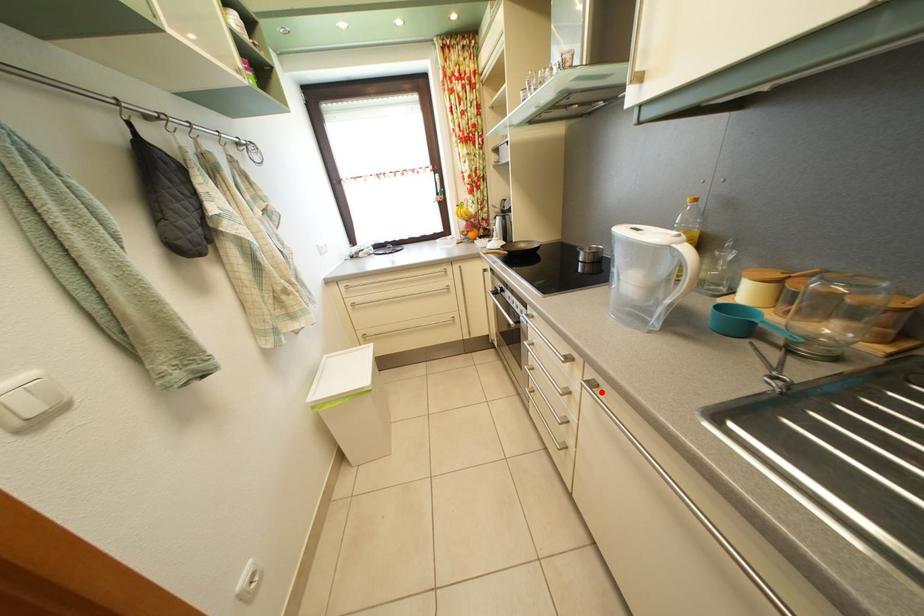
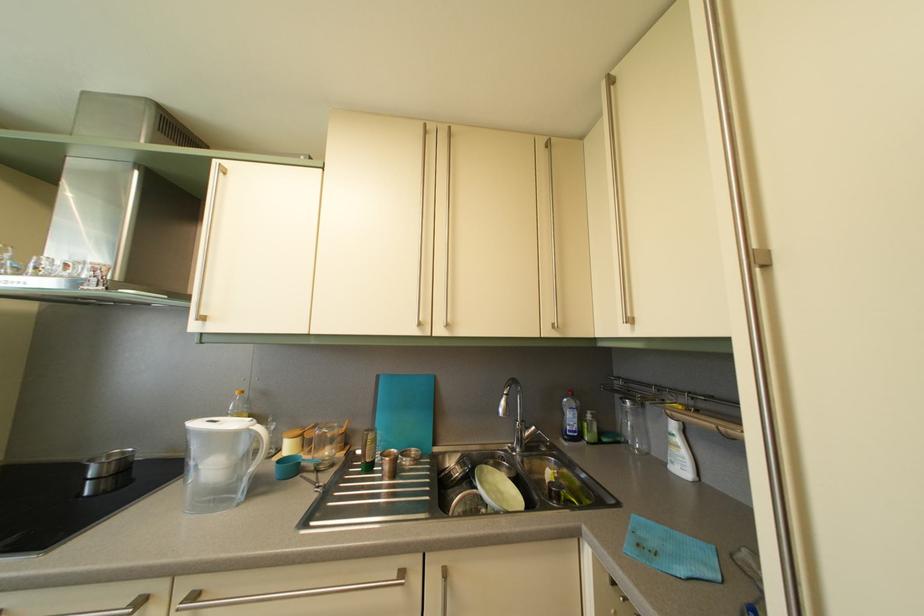
Question: I am providing you with two images of the same scene from different viewpoints. In image1, a red point is highlighted. Considering the same 3D point in image2, which of the following is correct?

Choices:
 (A) It is closer
 (B) It is farther

Answer: (A)